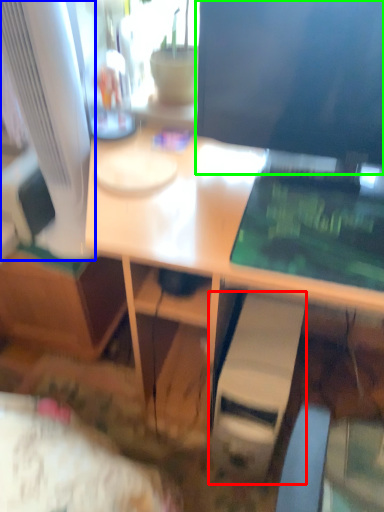
Question: Based on their relative distances, which object is nearer to computer tower (highlighted by a red box)? Choose from computer monitor (highlighted by a blue box) and computer monitor (highlighted by a green box).

Choices:
 (A) computer monitor
 (B) computer monitor

Answer: (B)